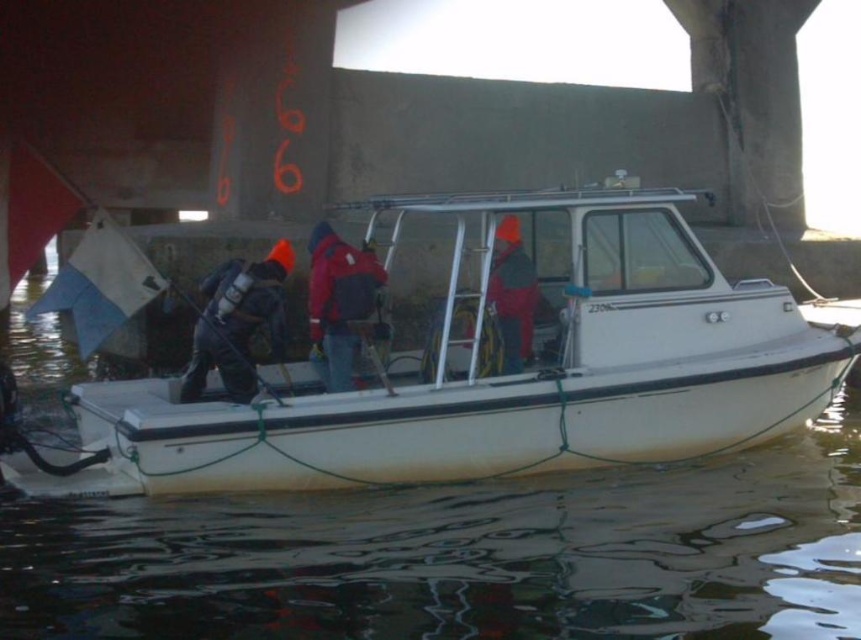
You are a photographer trying to capture a clear shot of the white matte boat at center and the orange knit hat at center. Since you want the boat to appear larger in the photo, which object should you move closer to the camera?

The white matte boat at center has a lesser height compared to orange knit hat at center. To make the boat appear larger in the photo, you should move the white matte boat at center closer to the camera.

You are planning to wear both the red nylon jacket at center and the red matte jacket at center for a cold day. Which jacket should you choose if you want the one with a larger size?

The red nylon jacket at center has a larger size compared to the red matte jacket at center, so you should choose the red nylon jacket at center.

You are standing at point (370, 289) and want to reach the boat docked under the concrete structure. The boat is 8.54 meters away from you. If your walking speed is 1.2 meters per second, how many seconds will it take you to reach the boat?

The distance to the boat is 8.54 meters, and your speed is 1.2 meters per second. To calculate the time, divide the distance by the speed. 8.54 divided by 1.2 equals approximately 7.12 seconds. Therefore, it will take about 7.12 seconds to reach the boat.